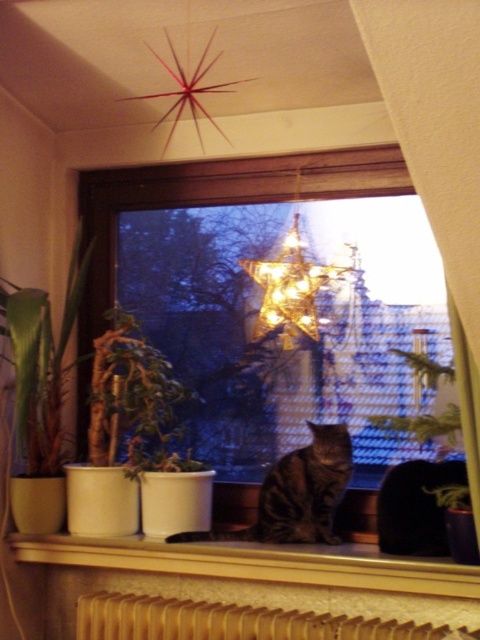
Between metallic star at center and green matte plant at left, which one has less height?

With less height is green matte plant at left.

Is metallic star at center taller than green matte plant at left?

Yes.

Is point (435, 310) behind point (109, 440)?

No, (435, 310) is in front of (109, 440).

Find the location of a particular element. metallic star at center is located at coordinates (275, 298).

Looking at this image, who is taller, wooden radiator at lower center or green matte plant at left?

With more height is green matte plant at left.

Does point (446, 627) lie in front of point (118, 400)?

Yes, point (446, 627) is in front of point (118, 400).

Is point (207, 609) behind point (123, 314)?

No, it is not.

Where is `wooden radiator at lower center`? This screenshot has width=480, height=640. wooden radiator at lower center is located at coordinates (235, 621).

Can you confirm if white ceramic window sill at center is positioned below wooden radiator at lower center?

No.

Can you confirm if white ceramic window sill at center is positioned above wooden radiator at lower center?

Correct, white ceramic window sill at center is located above wooden radiator at lower center.

This screenshot has width=480, height=640. Identify the location of white ceramic window sill at center. pyautogui.click(x=257, y=563).